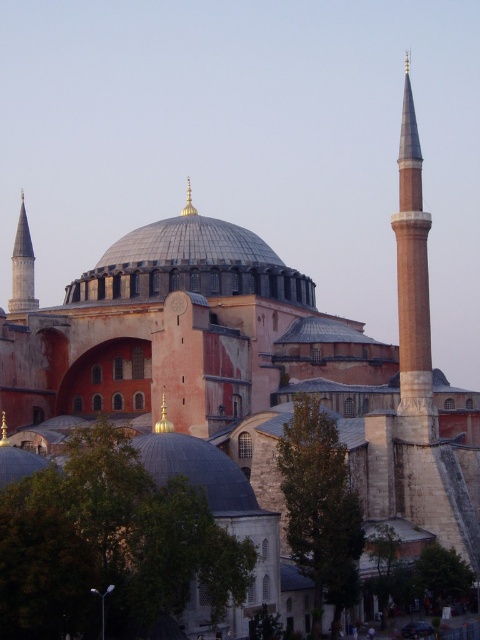
Question: Which point is farther from the camera taking this photo?

Choices:
 (A) (187, 180)
 (B) (26, 291)

Answer: (A)

Question: Is smooth stone minaret at left closer to camera compared to gold metallic spire at center?

Choices:
 (A) yes
 (B) no

Answer: (A)

Question: Does smooth stone minaret at left lie behind gold metallic spire at center?

Choices:
 (A) yes
 (B) no

Answer: (B)

Question: Can you confirm if smooth stone minaret at left is positioned above gold metallic spire at center?

Choices:
 (A) yes
 (B) no

Answer: (A)

Question: Which object is farther from the camera taking this photo?

Choices:
 (A) smooth stone minaret at left
 (B) gold metallic spire at center

Answer: (B)